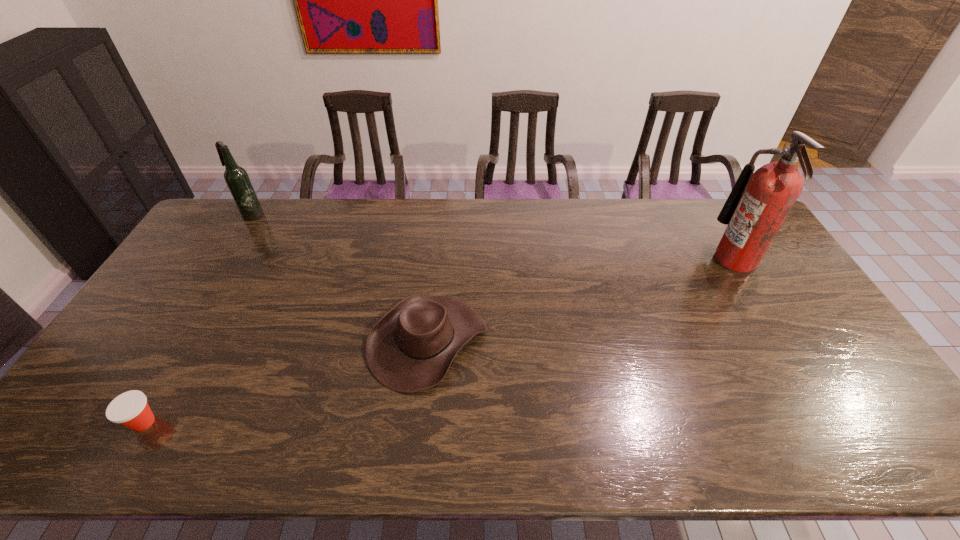
Locate an element on the screen. This screenshot has width=960, height=540. object that is at the near left corner is located at coordinates (130, 409).

In the image, there is a desktop. Identify the location of free space at the far edge. This screenshot has width=960, height=540. click(359, 212).

Identify the location of vacant space at the left edge of the desktop. (150, 353).

In the image, there is a desktop. Where is `free region at the far left corner`? Image resolution: width=960 pixels, height=540 pixels. free region at the far left corner is located at coordinates (222, 227).

Image resolution: width=960 pixels, height=540 pixels. I want to click on vacant space at the near left corner, so click(x=75, y=433).

At what (x,y) coordinates should I click in order to perform the action: click on free point between the beer bottle and the cowboy hat. Please return your answer as a coordinate pair (x, y). Looking at the image, I should click on (340, 278).

Locate an element on the screen. free point between the third farthest object and the Dixie cup is located at coordinates (286, 381).

Locate an element on the screen. vacant region between the nearest object and the farthest object is located at coordinates (198, 319).

In order to click on unoccupied position between the tallest object and the cowboy hat in this screenshot , I will do `click(582, 300)`.

Identify the location of free spot between the farthest object and the Dixie cup. This screenshot has height=540, width=960. (198, 319).